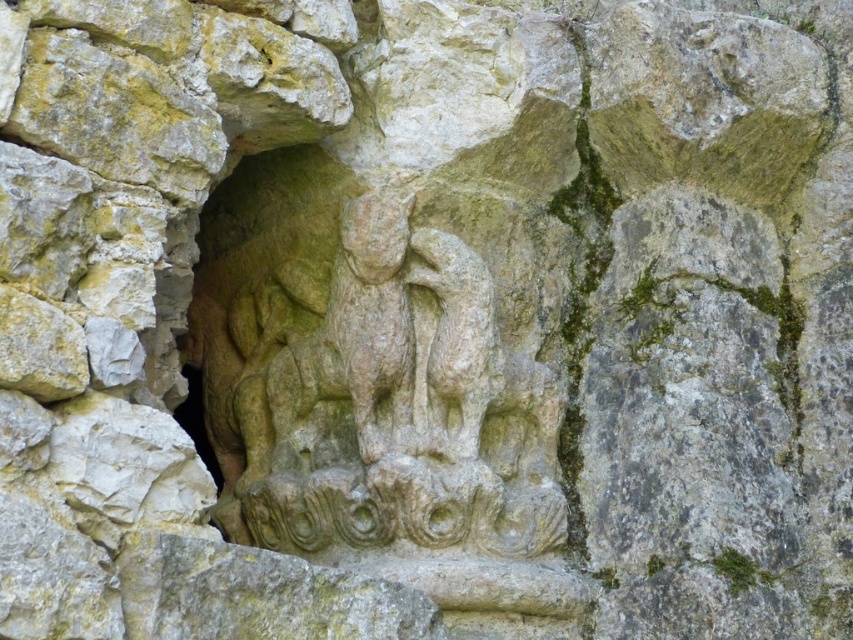
You are an archaeologist examining the stone carving. You notice a specific point at coordinates (381,401). What does this point correspond to in the carving?

The point at coordinates (381,401) corresponds to the stone relief sculpture at center.

You are an archaeologist examining the stone structure. You notice two objects labeled as the stone relief sculpture at center and the stone carving at center. According to the spatial relationship between them, which one is positioned lower?

The stone relief sculpture at center is positioned below the stone carving at center, so it is the lower one.